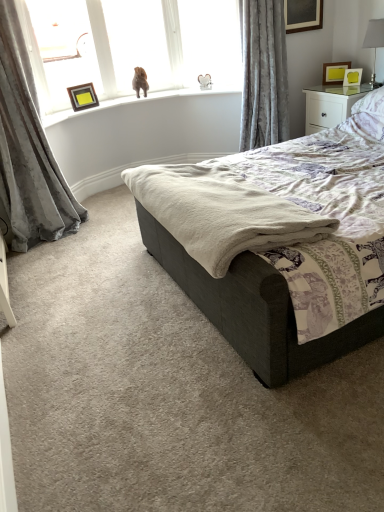
Question: Is the depth of white soft pillow at upper right greater than that of wooden picture frame at upper left, the first picture frame viewed from the left?

Choices:
 (A) yes
 (B) no

Answer: (B)

Question: From the image's perspective, is white soft pillow at upper right located above wooden picture frame at upper left, the first picture frame viewed from the left?

Choices:
 (A) no
 (B) yes

Answer: (A)

Question: Does white soft pillow at upper right have a greater height compared to wooden picture frame at upper left, marked as the 3th picture frame in a right-to-left arrangement?

Choices:
 (A) yes
 (B) no

Answer: (A)

Question: Are white soft pillow at upper right and wooden picture frame at upper left, marked as the 3th picture frame in a right-to-left arrangement, far apart?

Choices:
 (A) yes
 (B) no

Answer: (A)

Question: From a real-world perspective, does white soft pillow at upper right sit lower than wooden picture frame at upper left, marked as the 3th picture frame in a right-to-left arrangement?

Choices:
 (A) yes
 (B) no

Answer: (A)

Question: Is white soft pillow at upper right bigger than wooden picture frame at upper left, marked as the 3th picture frame in a right-to-left arrangement?

Choices:
 (A) no
 (B) yes

Answer: (B)

Question: Is matte glass window screen at upper left taller than white glossy table lamp at upper right?

Choices:
 (A) no
 (B) yes

Answer: (B)

Question: Is matte glass window screen at upper left touching white glossy table lamp at upper right?

Choices:
 (A) yes
 (B) no

Answer: (B)

Question: Can you confirm if matte glass window screen at upper left is thinner than white glossy table lamp at upper right?

Choices:
 (A) yes
 (B) no

Answer: (A)

Question: From a real-world perspective, is matte glass window screen at upper left below white glossy table lamp at upper right?

Choices:
 (A) yes
 (B) no

Answer: (B)

Question: Does matte glass window screen at upper left appear on the left side of white glossy table lamp at upper right?

Choices:
 (A) yes
 (B) no

Answer: (A)

Question: Is matte glass window screen at upper left facing towards white glossy table lamp at upper right?

Choices:
 (A) yes
 (B) no

Answer: (B)

Question: Is velvet gray curtain at left, the first curtain viewed from the left, facing towards white soft pillow at upper right?

Choices:
 (A) no
 (B) yes

Answer: (A)